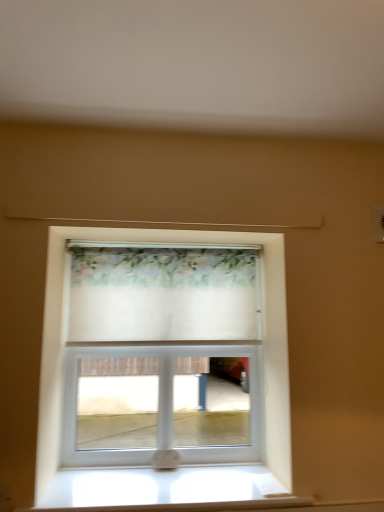
Question: Considering their positions, is white wood window sill at lower center located in front of or behind floral sheer curtain at center?

Choices:
 (A) front
 (B) behind

Answer: (A)

Question: Is point [152, 504] closer or farther from the camera than point [87, 276]?

Choices:
 (A) farther
 (B) closer

Answer: (B)

Question: Considering the real-world distances, which object is closest to the white fabric at center?

Choices:
 (A) white wood window sill at lower center
 (B) floral sheer curtain at center

Answer: (B)

Question: Estimate the real-world distances between objects in this image. Which object is closer to the white fabric at center?

Choices:
 (A) floral sheer curtain at center
 (B) white wood window sill at lower center

Answer: (A)